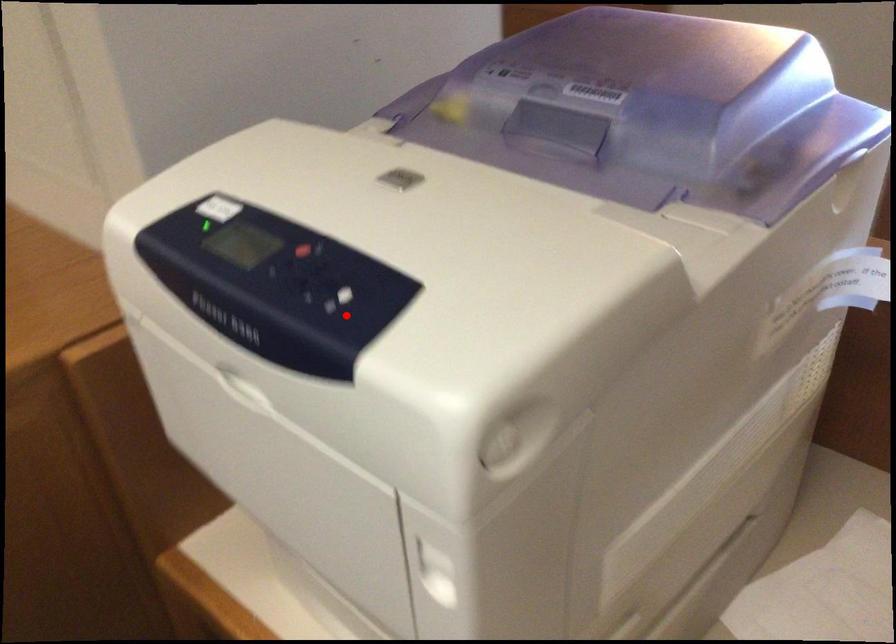
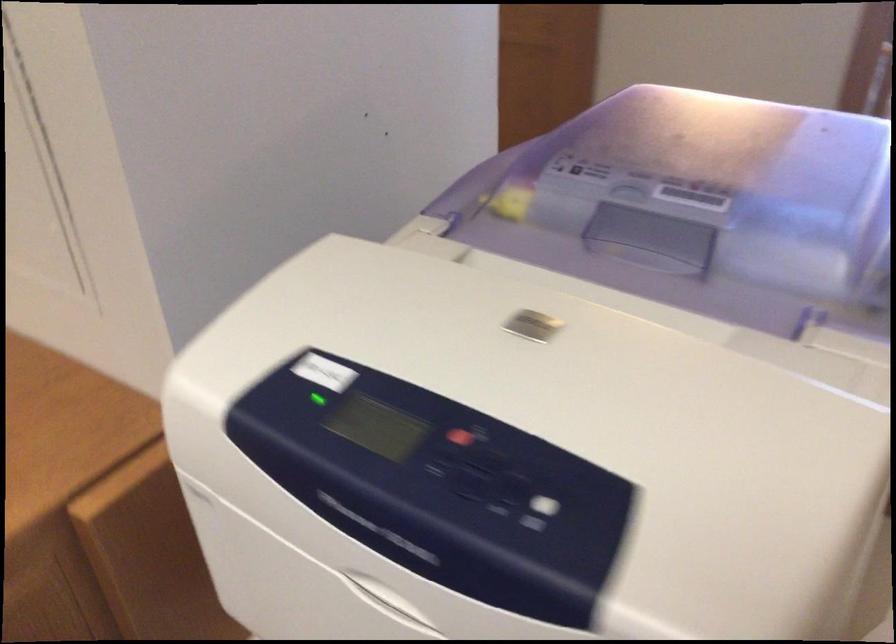
Where in the second image is the point corresponding to the highlighted location from the first image?

(538, 512)